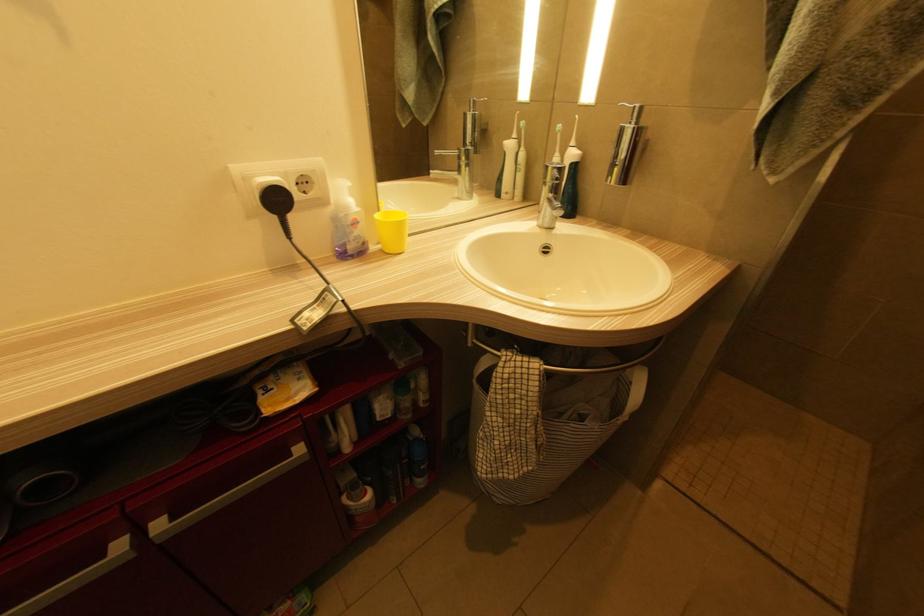
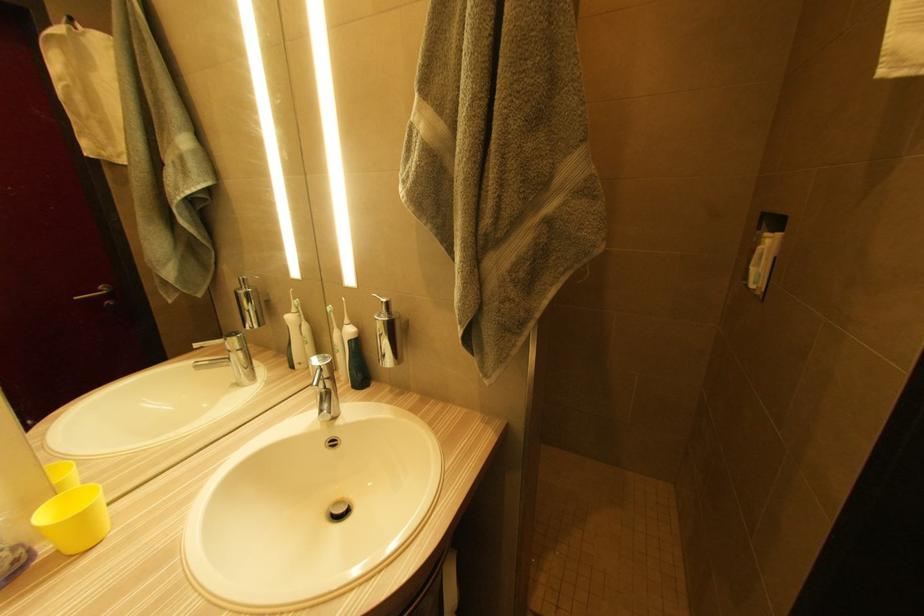
Question: The images are taken continuously from a first-person perspective. In which direction is your viewpoint rotating?

Choices:
 (A) Left
 (B) Right
 (C) Up
 (D) Down

Answer: (B)